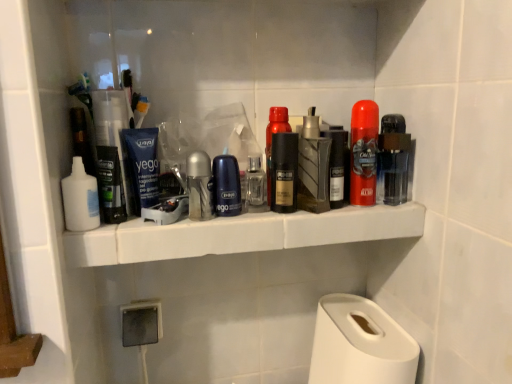
What do you see at coordinates (226, 186) in the screenshot?
I see `blue matte deodorant at center, the 6th personal care viewed from the right` at bounding box center [226, 186].

In order to face white plastic shelf at center, should I rotate leftwards or rightwards?

A 0.741 degree turn to the left will do.

What do you see at coordinates (240, 234) in the screenshot?
I see `white plastic shelf at center` at bounding box center [240, 234].

Locate an element on the screen. metallic textured spray can at center, the 1th toiletry viewed from the right is located at coordinates tap(313, 166).

Locate an element on the screen. the 3rd toiletry counting from the left of the matte black deodorant at center, which ranks as the fourth personal care in right-to-left order is located at coordinates (80, 198).

Which object is thinner, matte black deodorant at center, acting as the 5th personal care starting from the left, or white matte lotion at left, acting as the first toiletry starting from the left?

matte black deodorant at center, acting as the 5th personal care starting from the left, is thinner.

Which is behind, point (276, 150) or point (71, 221)?

Point (276, 150)

Who is smaller, matte black deodorant at center, acting as the eighth personal care starting from the right, or shiny red can at center, the second personal care in the right-to-left sequence?

shiny red can at center, the second personal care in the right-to-left sequence.

Where is `personal care that is the 6th one below the shiny red can at center, which is counted as the 7th personal care, starting from the left (from a real-world perspective)`? personal care that is the 6th one below the shiny red can at center, which is counted as the 7th personal care, starting from the left (from a real-world perspective) is located at coordinates click(110, 185).

Does point (104, 190) come closer to viewer compared to point (352, 195)?

Yes, point (104, 190) is closer to viewer.

Is matte black deodorant at center, arranged as the 1th personal care when viewed from the left, situated inside shiny red can at center, the second personal care in the right-to-left sequence, or outside?

matte black deodorant at center, arranged as the 1th personal care when viewed from the left, cannot be found inside shiny red can at center, the second personal care in the right-to-left sequence.

From the image's perspective, is metallic silver deodorant at center, arranged as the 3th toiletry when viewed from the right, above or below matte black deodorant at center, which ranks as the fourth personal care in right-to-left order?

Based on their image positions, metallic silver deodorant at center, arranged as the 3th toiletry when viewed from the right, is located beneath matte black deodorant at center, which ranks as the fourth personal care in right-to-left order.

Is metallic silver deodorant at center, the second toiletry when ordered from left to right, completely or partially outside of matte black deodorant at center, acting as the 5th personal care starting from the left?

metallic silver deodorant at center, the second toiletry when ordered from left to right, is positioned outside matte black deodorant at center, acting as the 5th personal care starting from the left.

Is metallic silver deodorant at center, arranged as the 3th toiletry when viewed from the right, turned away from matte black deodorant at center, which ranks as the fourth personal care in right-to-left order?

That's not correct — metallic silver deodorant at center, arranged as the 3th toiletry when viewed from the right, is not looking away from matte black deodorant at center, which ranks as the fourth personal care in right-to-left order.

From a real-world perspective, is metallic silver deodorant at center, the second toiletry when ordered from left to right, located beneath matte black deodorant at center, acting as the 5th personal care starting from the left?

Yes, from a real-world perspective, metallic silver deodorant at center, the second toiletry when ordered from left to right, is under matte black deodorant at center, acting as the 5th personal care starting from the left.

Considering the sizes of objects metallic textured spray can at center, the fourth toiletry positioned from the left, and white matte paper towel at lower right in the image provided, who is wider, metallic textured spray can at center, the fourth toiletry positioned from the left, or white matte paper towel at lower right?

Wider between the two is white matte paper towel at lower right.

From a real-world perspective, which is physically below, metallic textured spray can at center, the fourth toiletry positioned from the left, or white matte paper towel at lower right?

From a 3D spatial view, white matte paper towel at lower right is below.

What's the angular difference between metallic textured spray can at center, the fourth toiletry positioned from the left, and white matte paper towel at lower right's facing directions?

They differ by 2.69 degrees in their facing directions.

Is white matte paper towel at lower right at the back of metallic textured spray can at center, the fourth toiletry positioned from the left?

No, metallic textured spray can at center, the fourth toiletry positioned from the left,'s orientation is not away from white matte paper towel at lower right.

How different are the orientations of blue matte tube at center, which appears as the 2th personal care when viewed from the left, and metallic gold can at center, the fifth personal care in the right-to-left sequence, in degrees?

The angular difference between blue matte tube at center, which appears as the 2th personal care when viewed from the left, and metallic gold can at center, the fifth personal care in the right-to-left sequence, is 1.96 degrees.

Between blue matte tube at center, which is counted as the 7th personal care, starting from the right, and metallic gold can at center, placed as the 4th personal care when sorted from left to right, which one has less height?

blue matte tube at center, which is counted as the 7th personal care, starting from the right.

Does point (148, 195) come farther from viewer compared to point (266, 136)?

No, (148, 195) is closer to viewer.

From a real-world perspective, which object stands above the other?

metallic gold can at center, the fifth personal care in the right-to-left sequence, from a real-world perspective.

Based on the photo, from a real-world perspective, is matte black deodorant at center, acting as the 5th personal care starting from the left, located higher than metallic silver deodorant at center, arranged as the 3th toiletry when viewed from the right?

Yes, from a real-world perspective, matte black deodorant at center, acting as the 5th personal care starting from the left, is above metallic silver deodorant at center, arranged as the 3th toiletry when viewed from the right.

You are a GUI agent. You are given a task and a screenshot of the screen. Output one action in this format:
    pyautogui.click(x=<x>, y=<y>)
    Task: Click on the personal care that is the 2nd one above the metallic silver deodorant at center, the second toiletry when ordered from left to right (from a real-world perspective)
    Image resolution: width=512 pixels, height=384 pixels.
    Given the screenshot: What is the action you would take?
    pyautogui.click(x=284, y=172)

Considering the relative positions of matte black deodorant at center, which ranks as the fourth personal care in right-to-left order, and metallic silver deodorant at center, the second toiletry when ordered from left to right, in the image provided, is matte black deodorant at center, which ranks as the fourth personal care in right-to-left order, behind metallic silver deodorant at center, the second toiletry when ordered from left to right,?

Yes, matte black deodorant at center, which ranks as the fourth personal care in right-to-left order, is further from the camera.

Considering the sizes of objects matte black deodorant at center, which ranks as the fourth personal care in right-to-left order, and metallic silver deodorant at center, arranged as the 3th toiletry when viewed from the right, in the image provided, who is smaller, matte black deodorant at center, which ranks as the fourth personal care in right-to-left order, or metallic silver deodorant at center, arranged as the 3th toiletry when viewed from the right,?

Smaller between the two is matte black deodorant at center, which ranks as the fourth personal care in right-to-left order.

Could you tell me if matte black deodorant at center, acting as the 5th personal care starting from the left, is facing metallic textured spray can at center, the fourth toiletry positioned from the left?

No, matte black deodorant at center, acting as the 5th personal care starting from the left, is not aimed at metallic textured spray can at center, the fourth toiletry positioned from the left.

Does matte black deodorant at center, which ranks as the fourth personal care in right-to-left order, have a greater height compared to metallic textured spray can at center, the fourth toiletry positioned from the left?

No, matte black deodorant at center, which ranks as the fourth personal care in right-to-left order, is not taller than metallic textured spray can at center, the fourth toiletry positioned from the left.

Is metallic textured spray can at center, the fourth toiletry positioned from the left, completely or partially inside matte black deodorant at center, which ranks as the fourth personal care in right-to-left order?

No, matte black deodorant at center, which ranks as the fourth personal care in right-to-left order, does not contain metallic textured spray can at center, the fourth toiletry positioned from the left.

Would you say matte black deodorant at center, which ranks as the fourth personal care in right-to-left order, is a long distance from metallic textured spray can at center, the fourth toiletry positioned from the left?

No, matte black deodorant at center, which ranks as the fourth personal care in right-to-left order, is not far away from metallic textured spray can at center, the fourth toiletry positioned from the left.

You are a GUI agent. You are given a task and a screenshot of the screen. Output one action in this format:
    pyautogui.click(x=<x>, y=<y>)
    Task: Click on the toiletry that is the 3rd one when counting downward from the matte black deodorant at center, which ranks as the fourth personal care in right-to-left order (from the image's perspective)
    This screenshot has height=384, width=512.
    Given the screenshot: What is the action you would take?
    pyautogui.click(x=80, y=198)

At what (x,y) coordinates should I click in order to perform the action: click on the 6th personal care counting from the left of the shiny red can at center, the second personal care in the right-to-left sequence. Please return your answer as a coordinate pair (x, y). The image size is (512, 384). Looking at the image, I should click on [110, 185].

Estimate the real-world distances between objects in this image. Which object is further from blue matte deodorant at center, the 6th personal care viewed from the right, matte black deodorant at center, which ranks as the fourth personal care in right-to-left order, or white matte paper towel at lower right?

Among the two, white matte paper towel at lower right is located further to blue matte deodorant at center, the 6th personal care viewed from the right.

Looking at this image, from the image, which object appears to be farther from blue matte tube at center, which appears as the 2th personal care when viewed from the left, blue matte deodorant at center, the 6th personal care viewed from the right, or translucent plastic deodorant at center right, the eighth personal care in the left-to-right sequence?

Based on the image, translucent plastic deodorant at center right, the eighth personal care in the left-to-right sequence, appears to be further to blue matte tube at center, which appears as the 2th personal care when viewed from the left.

When comparing their distances from matte black deodorant at center, arranged as the 1th personal care when viewed from the left, does white matte lotion at left, acting as the first toiletry starting from the left, or white plastic shelf at center seem further?

Based on the image, white plastic shelf at center appears to be further to matte black deodorant at center, arranged as the 1th personal care when viewed from the left.

When comparing their distances from white matte paper towel at lower right, does metallic silver deodorant at center, the second toiletry when ordered from left to right, or clear glass spray bottle at center, which appears as the 3th toiletry when viewed from the left, seem further?

metallic silver deodorant at center, the second toiletry when ordered from left to right.

When comparing their distances from translucent plastic deodorant at center right, the eighth personal care in the left-to-right sequence, does white matte lotion at left, acting as the first toiletry starting from the left, or matte black deodorant at center, which ranks as the fourth personal care in right-to-left order, seem further?

white matte lotion at left, acting as the first toiletry starting from the left, is positioned further to the anchor translucent plastic deodorant at center right, the eighth personal care in the left-to-right sequence.

Estimate the real-world distances between objects in this image. Which object is further from metallic silver razor at center, which is counted as the 6th personal care, starting from the left, white plastic shelf at center or matte black deodorant at center, acting as the eighth personal care starting from the right?

matte black deodorant at center, acting as the eighth personal care starting from the right.

Considering their positions, is metallic silver razor at center, which is counted as the 6th personal care, starting from the left, positioned further to metallic textured spray can at center, the fourth toiletry positioned from the left, than blue matte deodorant at center, which is counted as the third personal care, starting from the left?

blue matte deodorant at center, which is counted as the third personal care, starting from the left, is positioned further to the anchor metallic textured spray can at center, the fourth toiletry positioned from the left.

Consider the image. Which object lies further to the anchor point metallic silver deodorant at center, the second toiletry when ordered from left to right, clear glass spray bottle at center, acting as the 2th toiletry starting from the right, or metallic silver razor at center, which is counted as the 6th personal care, starting from the left?

metallic silver razor at center, which is counted as the 6th personal care, starting from the left, is further to metallic silver deodorant at center, the second toiletry when ordered from left to right.

Find the location of a particular element. toiletry between matte black deodorant at center, arranged as the 1th personal care when viewed from the left, and white plastic shelf at center is located at coordinates (199, 186).

Locate an element on the screen. The height and width of the screenshot is (384, 512). ledge between metallic silver deodorant at center, the second toiletry when ordered from left to right, and metallic textured spray can at center, the 1th toiletry viewed from the right is located at coordinates (240, 234).

Where is `ledge located between matte black deodorant at center, arranged as the 1th personal care when viewed from the left, and translucent plastic deodorant at center right, which is the first personal care from right to left, in the left-right direction`? ledge located between matte black deodorant at center, arranged as the 1th personal care when viewed from the left, and translucent plastic deodorant at center right, which is the first personal care from right to left, in the left-right direction is located at coordinates (240, 234).

You are a GUI agent. You are given a task and a screenshot of the screen. Output one action in this format:
    pyautogui.click(x=<x>, y=<y>)
    Task: Click on the ledge located between white matte lotion at left, the fourth toiletry positioned from the right, and matte black deodorant at center, which ranks as the fourth personal care in right-to-left order, in the left-right direction
    This screenshot has width=512, height=384.
    Given the screenshot: What is the action you would take?
    pyautogui.click(x=240, y=234)